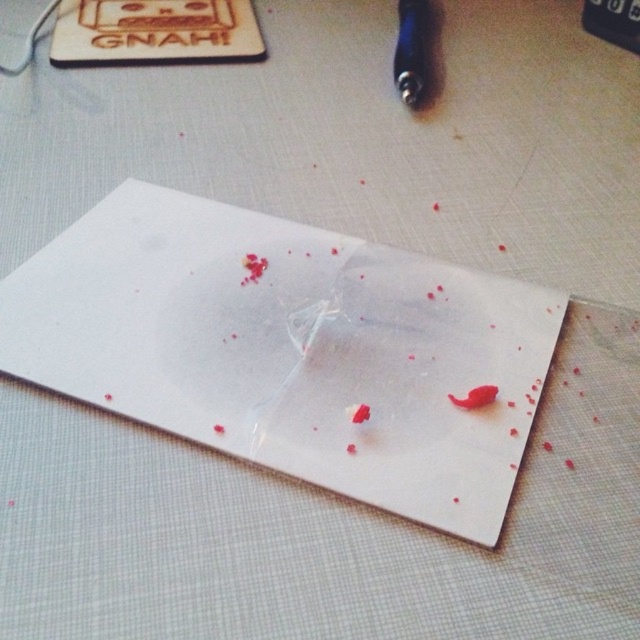
You are a person with an arm length of 0.8 meters. You are sitting at a desk and see the white matte paper at center. Can you reach it without moving your chair?

The white matte paper at center is 1.03 meters away from the viewer. Since your arm length is 0.8 meters, you cannot reach it without moving your chair.

You are looking at the paper and notice two points marked on it. Which point is closer to you, point [490,314] or point [484,392]?

Point [490,314] is further to the viewer than point [484,392], so point [484,392] is closer to you.

You are a photographer standing 1.03 meters away from the white matte paper at center. You want to take a clear photo of it. What should you do to ensure the camera is at the correct distance?

The white matte paper at center and camera are 1.03 meters apart, so you should position the camera exactly 1.03 meters away from the white matte paper at center to capture it clearly.